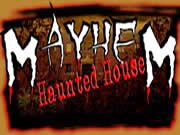
Locate an element on the screen. window is located at coordinates (68, 49).